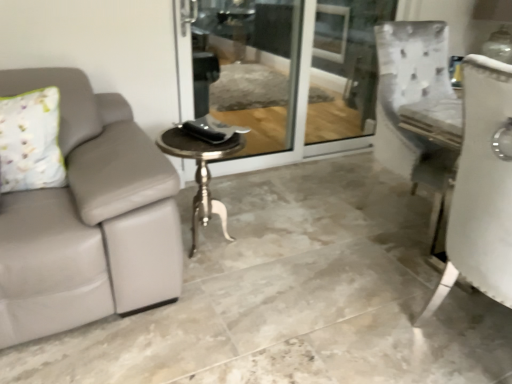
The image size is (512, 384). Identify the location of vacant space in front of polished silver table at center. (218, 297).